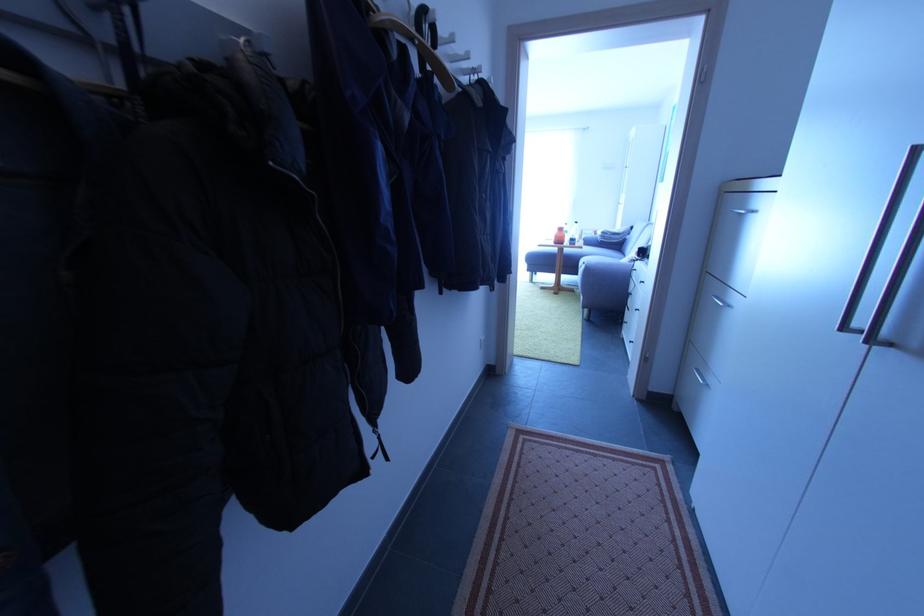
Find the location of a particular element. This screenshot has height=616, width=924. wooden hanger is located at coordinates (412, 45).